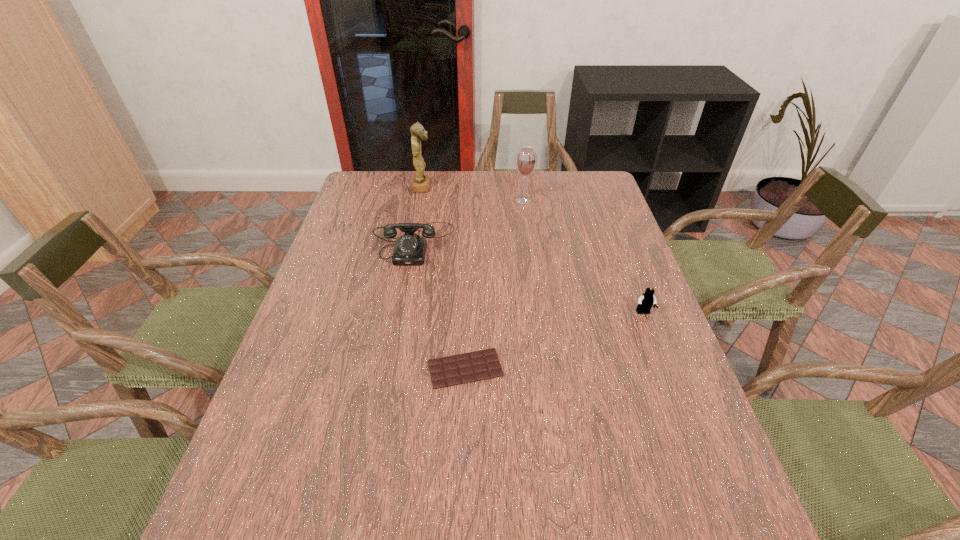
Locate an element on the screen. The image size is (960, 540). figurine is located at coordinates (421, 182).

Locate an element on the screen. the farthest object is located at coordinates (421, 182).

Where is `wineglass`? wineglass is located at coordinates (526, 160).

You are a GUI agent. You are given a task and a screenshot of the screen. Output one action in this format:
    pyautogui.click(x=<x>, y=<y>)
    Task: Click on the fourth nearest object
    The image size is (960, 540).
    Given the screenshot: What is the action you would take?
    pyautogui.click(x=526, y=160)

Where is `the third nearest object`? The width and height of the screenshot is (960, 540). the third nearest object is located at coordinates click(410, 249).

The height and width of the screenshot is (540, 960). In order to click on Lego in this screenshot , I will do `click(645, 302)`.

Locate an element on the screen. the fourth farthest object is located at coordinates (645, 302).

This screenshot has width=960, height=540. I want to click on the shortest object, so click(453, 370).

Image resolution: width=960 pixels, height=540 pixels. I want to click on chocolate bar, so click(453, 370).

Where is `vacant position located on the front-facing side of the figurine`? vacant position located on the front-facing side of the figurine is located at coordinates (475, 187).